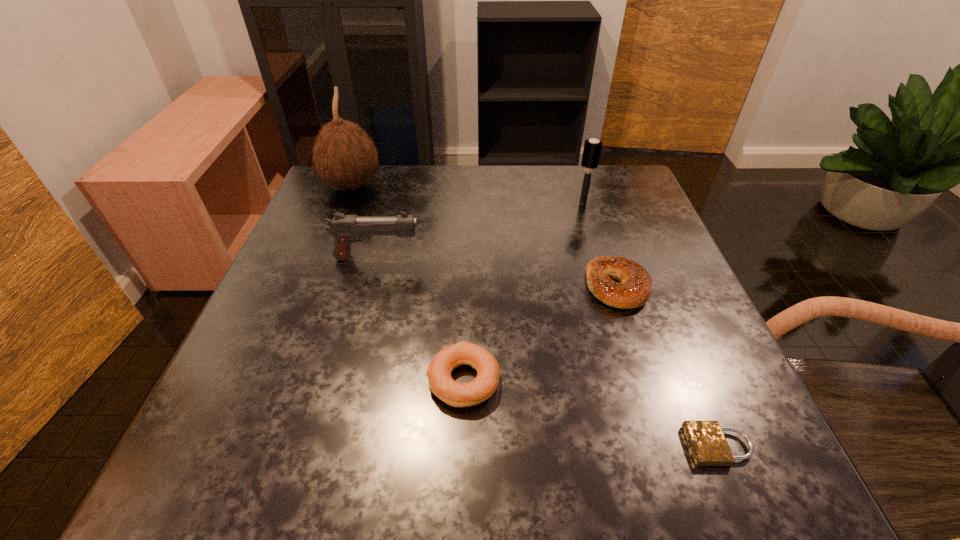
In the image, there is a desktop. In order to click on blank space at the left edge in this screenshot , I will do `click(317, 338)`.

In the image, there is a desktop. Where is `vacant space at the right edge`? The width and height of the screenshot is (960, 540). vacant space at the right edge is located at coordinates (602, 233).

In the image, there is a desktop. Where is `vacant space at the far left corner`? The image size is (960, 540). vacant space at the far left corner is located at coordinates (361, 204).

Locate an element on the screen. vacant space at the far right corner of the desktop is located at coordinates (629, 184).

Locate an element on the screen. empty location between the third nearest object and the fourth nearest object is located at coordinates (497, 272).

Locate an element on the screen. free space between the third farthest object and the shortest object is located at coordinates (548, 352).

This screenshot has width=960, height=540. Identify the location of vacant area that lies between the right bagel and the nearest object. (668, 366).

Find the location of `empty space that is in between the third tallest object and the farther bagel`. empty space that is in between the third tallest object and the farther bagel is located at coordinates (497, 272).

Locate an element on the screen. The width and height of the screenshot is (960, 540). vacant point located between the gun and the fourth object from right to left is located at coordinates (420, 319).

Where is `free spot between the third farthest object and the hairbrush`? The height and width of the screenshot is (540, 960). free spot between the third farthest object and the hairbrush is located at coordinates (480, 231).